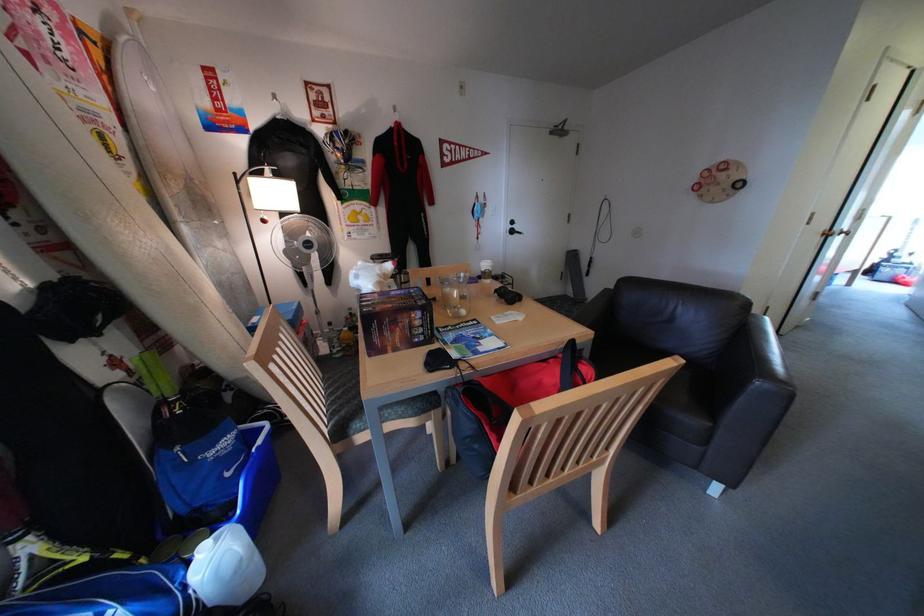
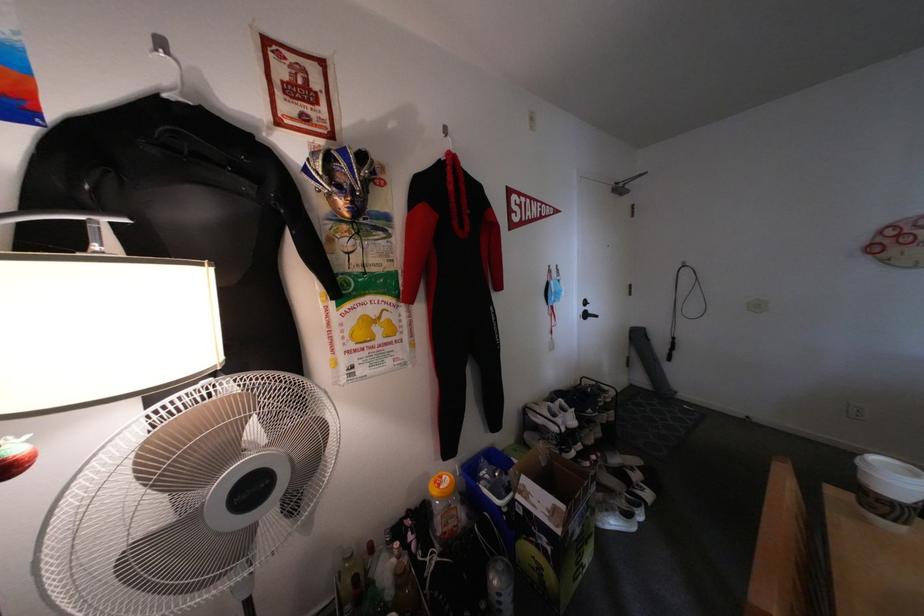
Where in the second image is the point corresponding to point 379,172 from the first image?

(404, 237)